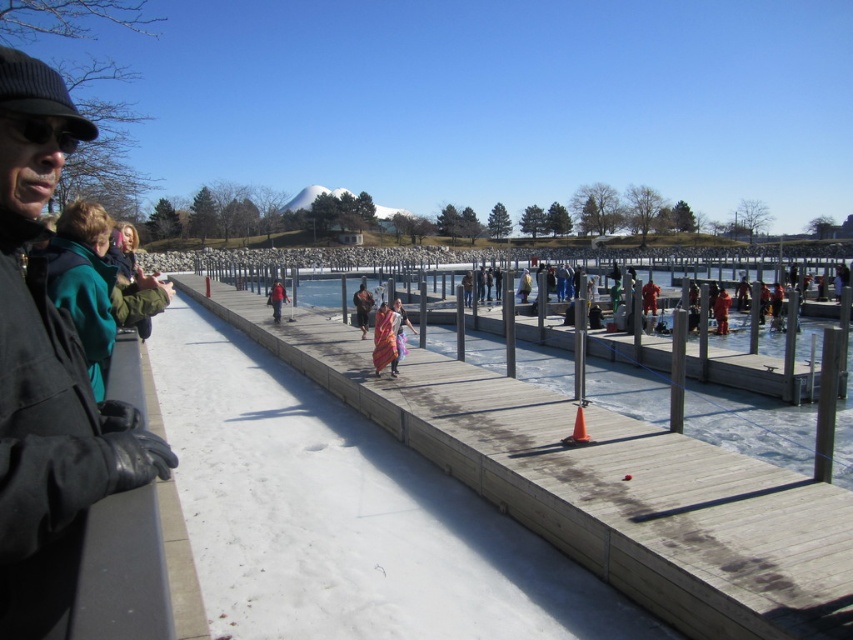
Which of these two, green woolen jacket at left or multicolored woven cloth at center, stands taller?

green woolen jacket at left is taller.

Can you confirm if green woolen jacket at left is positioned to the left of multicolored woven cloth at center?

Yes, green woolen jacket at left is to the left of multicolored woven cloth at center.

Which is in front, point (80, 298) or point (387, 333)?

Point (80, 298) is in front.

The width and height of the screenshot is (853, 640). Identify the location of green woolen jacket at left. (93, 285).

Is black woolen hat at upper left positioned in front of black matte goggles at upper left?

Yes, black woolen hat at upper left is closer to the viewer.

Consider the image. Which is more to the left, black woolen hat at upper left or black matte goggles at upper left?

black woolen hat at upper left is more to the left.

Between point (141, 444) and point (56, 125), which one is positioned in front?

Point (56, 125) is more forward.

Find the location of `black woolen hat at upper left`. black woolen hat at upper left is located at coordinates (67, 454).

Is black woolen hat at upper left below multicolored woven cloth at center?

Correct, black woolen hat at upper left is located below multicolored woven cloth at center.

Can you confirm if black woolen hat at upper left is shorter than multicolored woven cloth at center?

Incorrect, black woolen hat at upper left's height does not fall short of multicolored woven cloth at center's.

You are a GUI agent. You are given a task and a screenshot of the screen. Output one action in this format:
    pyautogui.click(x=<x>, y=<y>)
    Task: Click on the black woolen hat at upper left
    
    Given the screenshot: What is the action you would take?
    pyautogui.click(x=67, y=454)